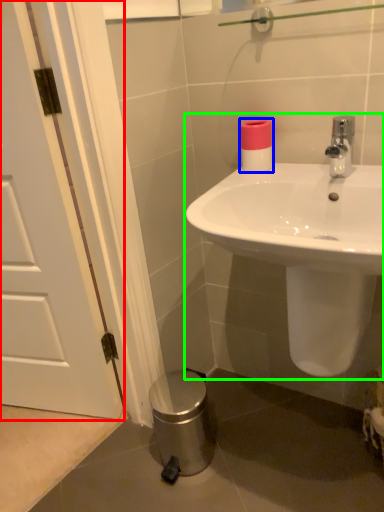
Question: Which object is positioned closest to door (highlighted by a red box)? Select from toilet paper (highlighted by a blue box) and sink (highlighted by a green box).

Choices:
 (A) toilet paper
 (B) sink

Answer: (B)